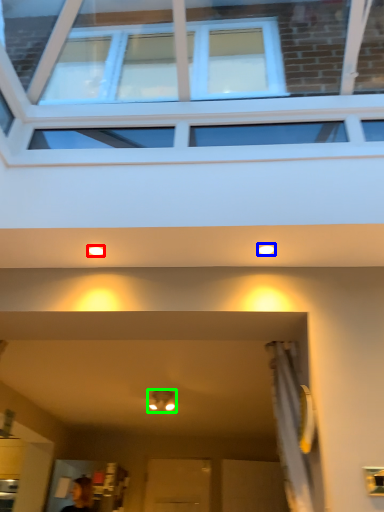
Question: Which object is the closest to the lighting (highlighted by a red box)? Choose among these: lighting (highlighted by a blue box) or light fixture (highlighted by a green box).

Choices:
 (A) lighting
 (B) light fixture

Answer: (A)